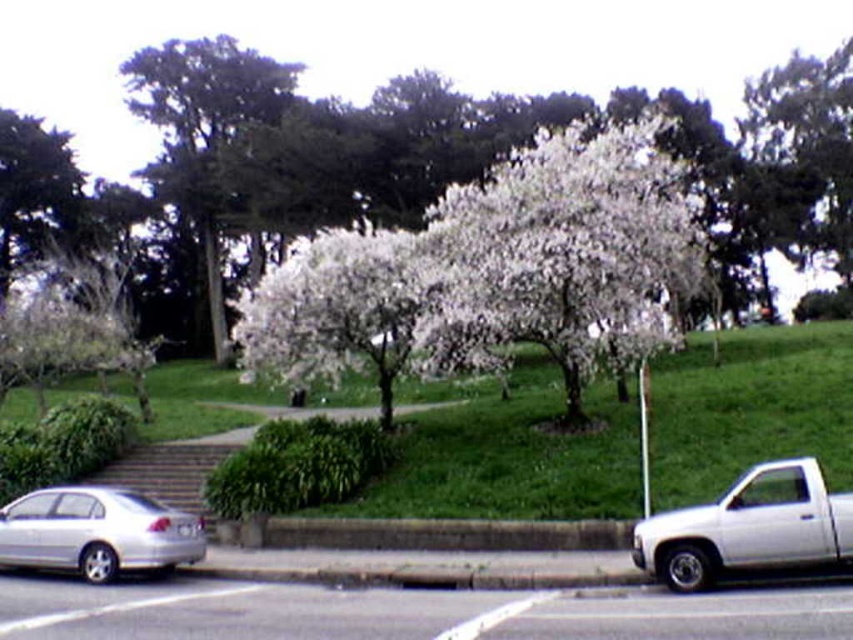
Does white matte truck at lower right have a greater height compared to concrete at lower center?

Correct, white matte truck at lower right is much taller as concrete at lower center.

Locate an element on the screen. The width and height of the screenshot is (853, 640). white matte truck at lower right is located at coordinates (749, 528).

What do you see at coordinates (749, 528) in the screenshot? I see `white matte truck at lower right` at bounding box center [749, 528].

From the picture: Between white matte truck at lower right and silver metallic sedan at lower left, which one appears on the left side from the viewer's perspective?

Positioned to the left is silver metallic sedan at lower left.

Is point (753, 522) farther from viewer compared to point (144, 497)?

That is False.

Identify the location of white matte truck at lower right. This screenshot has height=640, width=853. (749, 528).

You are a GUI agent. You are given a task and a screenshot of the screen. Output one action in this format:
    pyautogui.click(x=<x>, y=<y>)
    Task: Click on the silver metallic sedan at lower left
    Image resolution: width=853 pixels, height=640 pixels.
    Given the screenshot: What is the action you would take?
    pyautogui.click(x=97, y=532)

Where is `silver metallic sedan at lower left`? The image size is (853, 640). silver metallic sedan at lower left is located at coordinates (97, 532).